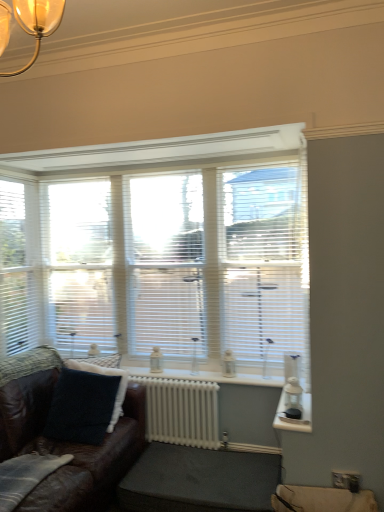
Identify the location of free space above dark gray fabric footrest at lower center (from a real-world perspective). (210, 467).